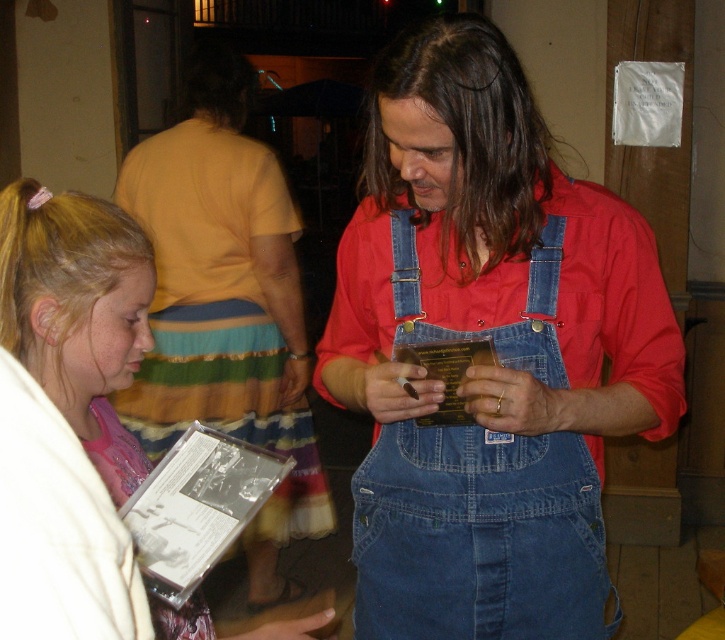
Looking at this image, you are a photographer taking a closeup shot of the white matte cd at lower left. You want to ensure the denim overalls at center is visible in the background but not too prominent. Given their sizes, can you achieve this without moving the camera?

The denim overalls at center is bigger than the white matte cd at lower left. Since the denim overalls is larger, it will naturally appear more prominent in the frame. To make it less prominent without moving the camera, you can adjust the focus or depth of field to blur the background where the denim overalls is located, thereby reducing its visibility while keeping the white matte cd at lower left sharp.

Based on the scene description, where is the white matte cd at lower left located in relation to the denim overalls at center?

The white matte cd at lower left is below the denim overalls at center.

What is located at the coordinates point (78, 314) in the image?

The white matte cd at lower left is located at point (78, 314).